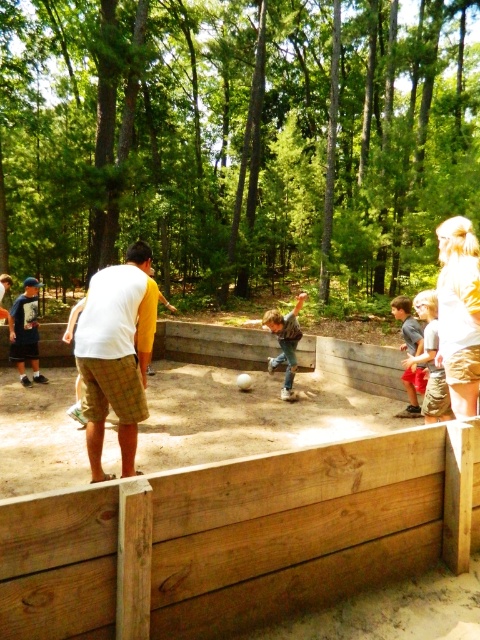
You are a photographer trying to capture a group photo of the white plaid shorts at center and the matte blue shirt at left. Since you want to ensure both subjects are fully visible in the frame, which subject requires a wider angle to accommodate their size?

The white plaid shorts at center requires a wider angle because its width surpasses that of the matte blue shirt at left.

You are standing at the point with coordinates point (25, 332) in the image. What object are you standing on?

The point (25, 332) is on the matte blue shirt at left.